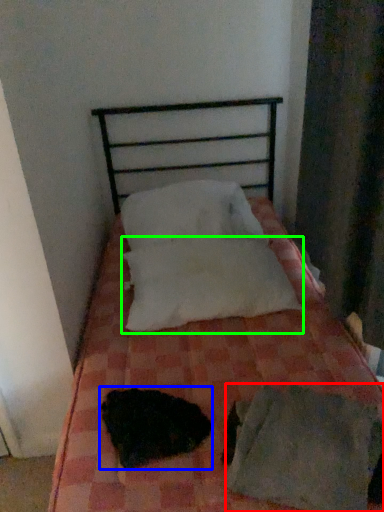
Question: Based on their relative distances, which object is farther from sheet (highlighted by a red box)? Choose from animal (highlighted by a blue box) and pillow (highlighted by a green box).

Choices:
 (A) animal
 (B) pillow

Answer: (B)